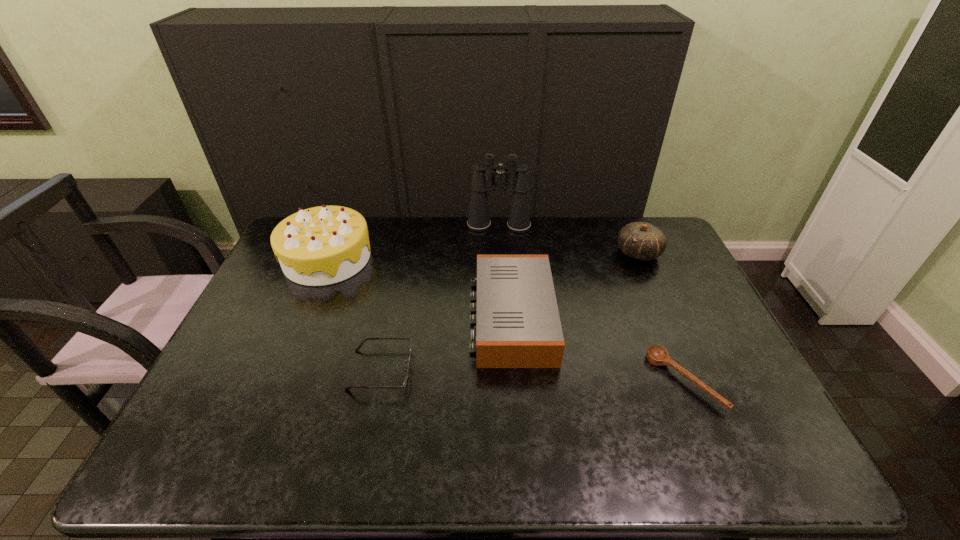
You are a GUI agent. You are given a task and a screenshot of the screen. Output one action in this format:
    pyautogui.click(x=<x>, y=<y>)
    Task: Click on the free region located on the left of the gourd
    The width and height of the screenshot is (960, 540).
    Given the screenshot: What is the action you would take?
    pyautogui.click(x=555, y=253)

Locate an element on the screen. vacant space located on the front panel of the radio receiver is located at coordinates (402, 318).

You are a GUI agent. You are given a task and a screenshot of the screen. Output one action in this format:
    pyautogui.click(x=<x>, y=<y>)
    Task: Click on the vacant space located on the front panel of the radio receiver
    The image size is (960, 540).
    Given the screenshot: What is the action you would take?
    pyautogui.click(x=416, y=318)

Image resolution: width=960 pixels, height=540 pixels. What are the coordinates of `vacant area situated 0.180m on the front panel of the radio receiver` in the screenshot? It's located at (409, 318).

Locate an element on the screen. This screenshot has height=540, width=960. vacant space located on the front-facing side of the spectacles is located at coordinates (545, 370).

Image resolution: width=960 pixels, height=540 pixels. I want to click on vacant space located 0.080m on the back of the shortest object, so click(x=662, y=329).

What are the coordinates of `binoculars at the far edge` in the screenshot? It's located at (483, 180).

This screenshot has height=540, width=960. Find the location of `birthday cake positioned at the far edge`. birthday cake positioned at the far edge is located at coordinates (323, 245).

Where is `gourd that is positioned at the far edge`? gourd that is positioned at the far edge is located at coordinates (640, 240).

Find the location of a particular element. Image resolution: width=960 pixels, height=540 pixels. object at the left edge is located at coordinates (323, 245).